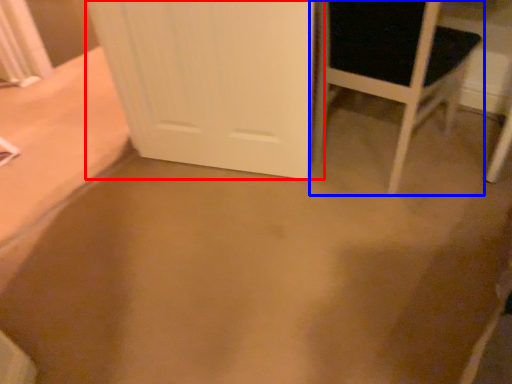
Question: Which object is further to the camera taking this photo, door (highlighted by a red box) or chair (highlighted by a blue box)?

Choices:
 (A) door
 (B) chair

Answer: (A)